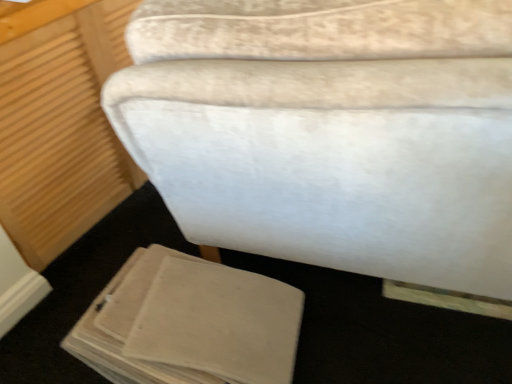
The image size is (512, 384). What do you see at coordinates (189, 324) in the screenshot?
I see `beige paper at lower left` at bounding box center [189, 324].

Locate an element on the screen. This screenshot has height=384, width=512. beige paper at lower left is located at coordinates (189, 324).

This screenshot has height=384, width=512. What are the coordinates of `beige paper at lower left` in the screenshot? It's located at (189, 324).